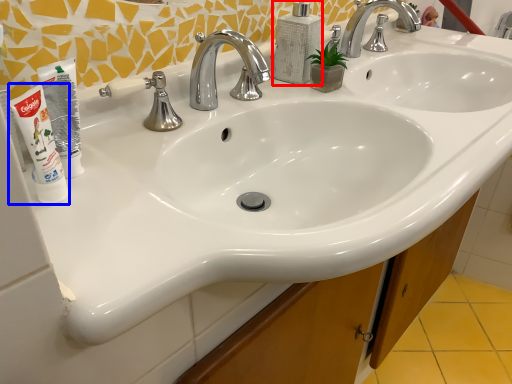
Question: Which of the following is the farthest to the observer, soap dispenser (highlighted by a red box) or shaving cream (highlighted by a blue box)?

Choices:
 (A) soap dispenser
 (B) shaving cream

Answer: (A)